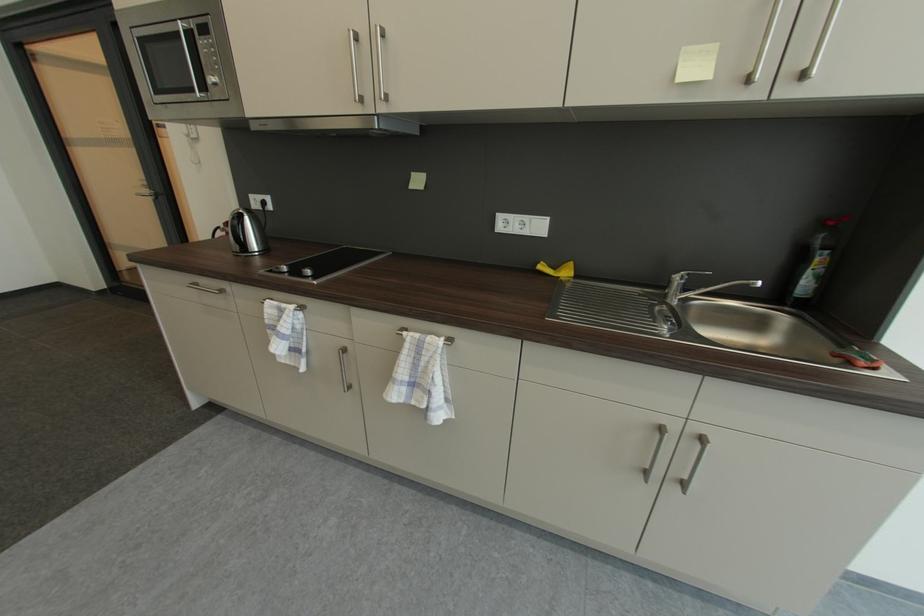
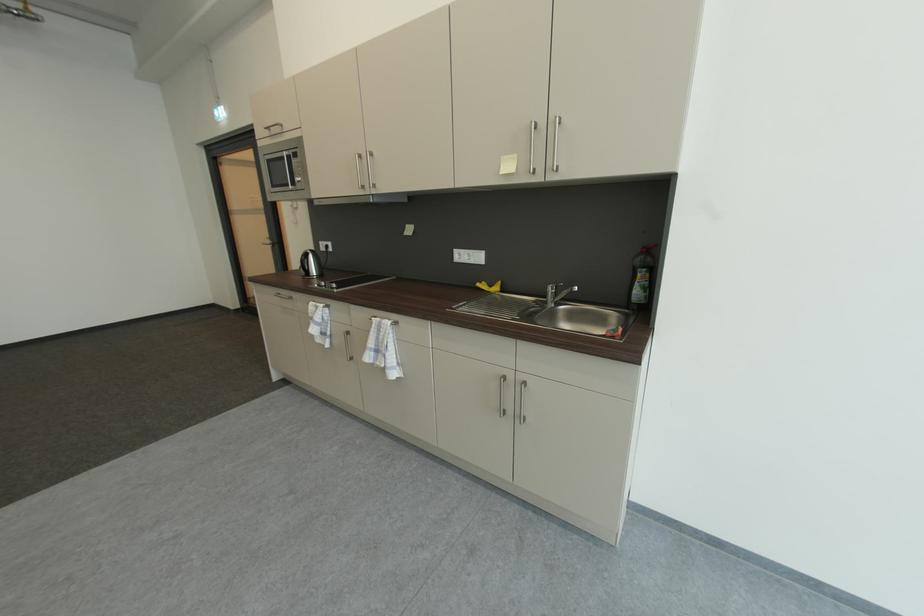
In the second image, find the point that corresponds to (x=543, y=265) in the first image.

(487, 284)